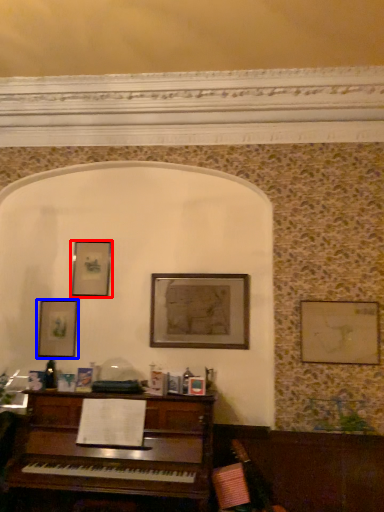
Question: Which of the following is the closest to the observer, picture frame (highlighted by a red box) or picture frame (highlighted by a blue box)?

Choices:
 (A) picture frame
 (B) picture frame

Answer: (B)